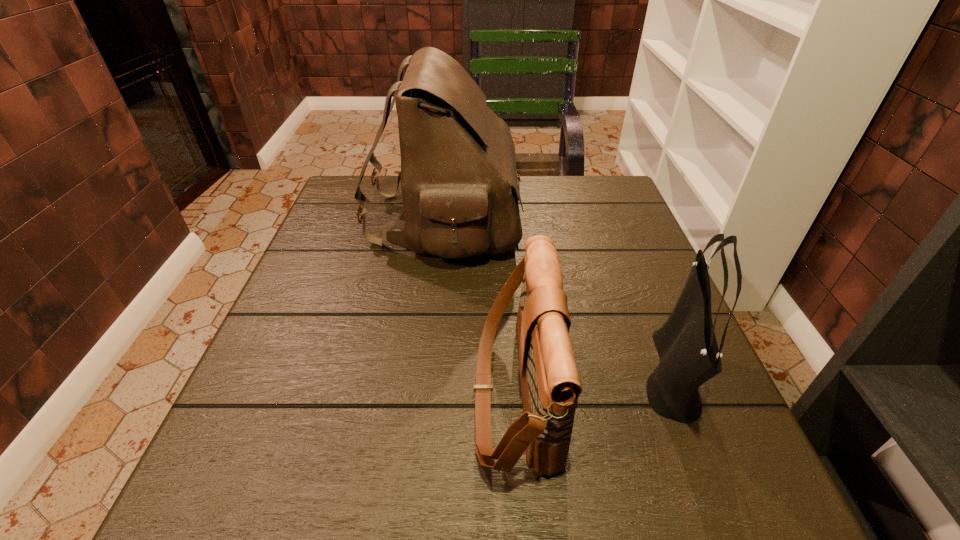
Where is `vacant space positioned 0.300m on the front-facing side of the shorter shoulder bag`? The width and height of the screenshot is (960, 540). vacant space positioned 0.300m on the front-facing side of the shorter shoulder bag is located at coordinates (303, 393).

At what (x,y) coordinates should I click in order to perform the action: click on object that is at the far edge. Please return your answer as a coordinate pair (x, y). This screenshot has height=540, width=960. Looking at the image, I should click on (459, 184).

Locate an element on the screen. object that is positioned at the near edge is located at coordinates (550, 383).

Where is `object that is at the left edge`? This screenshot has height=540, width=960. object that is at the left edge is located at coordinates (459, 184).

Identify the location of object that is at the right edge. This screenshot has height=540, width=960. (686, 344).

In order to click on object that is positioned at the far left corner in this screenshot , I will do `click(459, 184)`.

In the image, there is a desktop. In order to click on vacant space at the far edge in this screenshot , I will do `click(554, 201)`.

In the image, there is a desktop. At what (x,y) coordinates should I click in order to perform the action: click on free space at the near edge. Please return your answer as a coordinate pair (x, y). Looking at the image, I should click on (548, 480).

In the image, there is a desktop. Where is `free space at the left edge`? free space at the left edge is located at coordinates (238, 438).

Where is `vacant area at the right edge`? Image resolution: width=960 pixels, height=540 pixels. vacant area at the right edge is located at coordinates (657, 278).